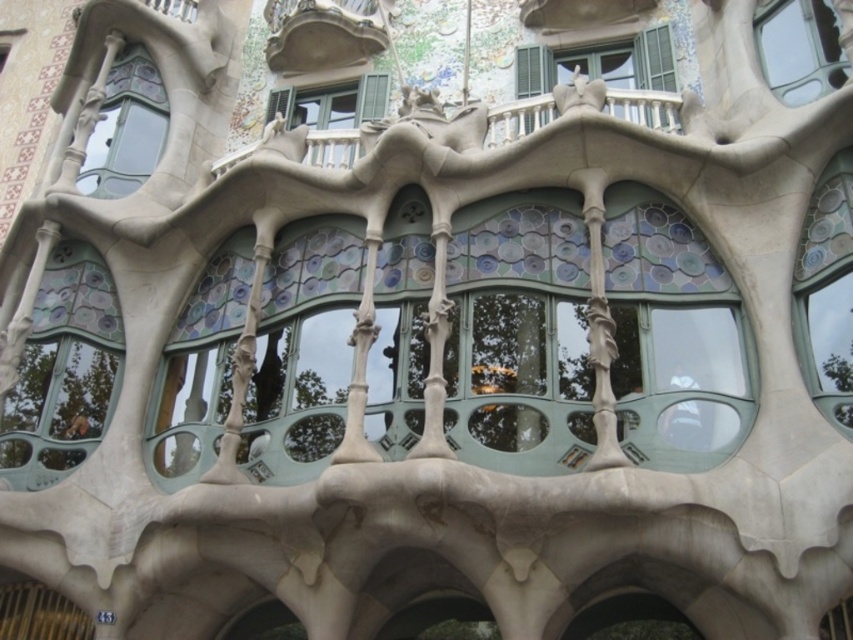
You are an architect analyzing the facade of Casa Batll? and need to determine the spatial relationship between the blue glass window at upper left and the matte stone balcony at upper center. Based on the image provided, which object is closer to the viewer?

The blue glass window at upper left is closer to the viewer than the matte stone balcony at upper center.

From the picture: You are standing in front of the Casa Batll? architectural structure and notice two points marked on the facade. The first point is at coordinates point (79, 408) and the second is at point (334, 51). Which of these points is closer to you?

Point (79, 408) is in front of point (334, 51), so it is closer to you.

You are standing in front of the architectural structure of Casa Batll? and want to touch the translucent glass window at left. Based on the distance provided, is it possible for you to reach it without any assistance?

The translucent glass window at left is 210.21 feet away from viewer, which is too far to reach without assistance. You would need a ladder or other equipment to get close enough.